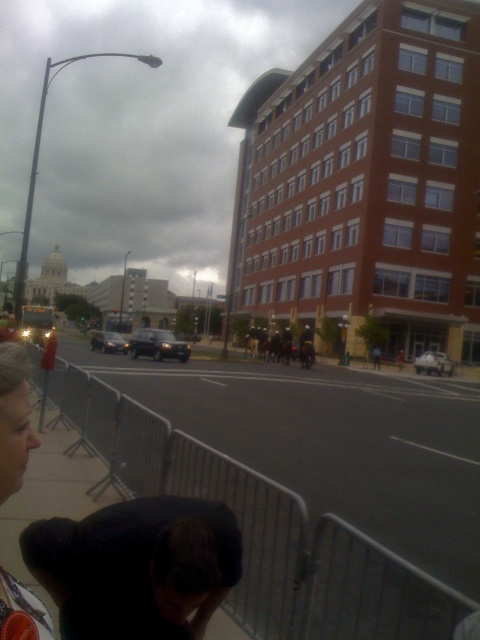
Question: Is matte black hair at lower left to the right of silver metallic sedan at center from the viewer's perspective?

Choices:
 (A) yes
 (B) no

Answer: (A)

Question: Is matte black hair at lower left wider than silver metallic sedan at center?

Choices:
 (A) yes
 (B) no

Answer: (B)

Question: Which of these objects is positioned closest to the white matte van at center?

Choices:
 (A) gray metallic pavement at lower center
 (B) matte black hair at lower left
 (C) silver metallic sedan at center

Answer: (C)

Question: Which point is closer to the camera taking this photo?

Choices:
 (A) (181, 344)
 (B) (104, 346)
 (C) (428, 364)

Answer: (A)

Question: Which object appears closest to the camera in this image?

Choices:
 (A) dark gray matte suv at center
 (B) silver metallic sedan at center

Answer: (A)

Question: Does gray metallic pavement at lower center have a smaller size compared to matte black hair at lower left?

Choices:
 (A) yes
 (B) no

Answer: (B)